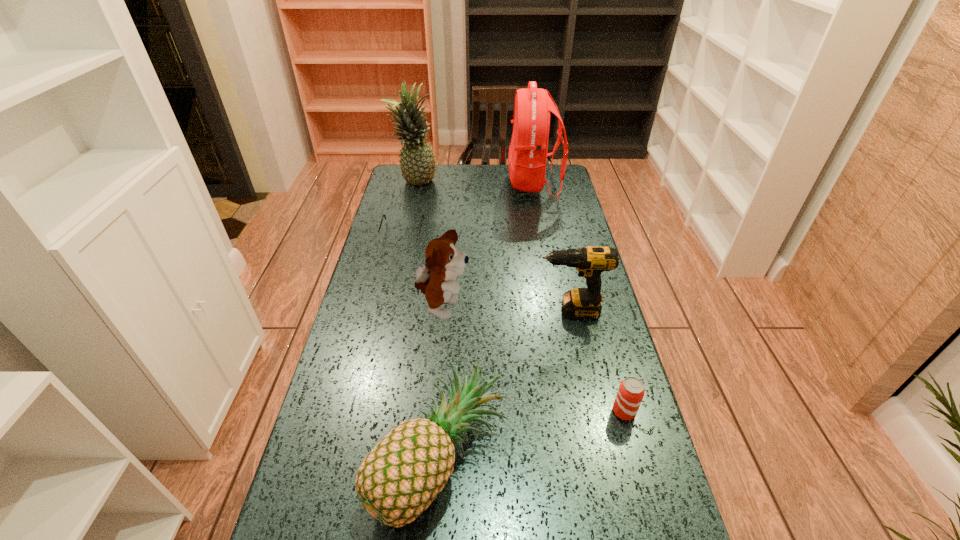
You are a GUI agent. You are given a task and a screenshot of the screen. Output one action in this format:
    pyautogui.click(x=<x>, y=<y>)
    Task: Click on the spectacles present at the left edge
    Image resolution: width=960 pixels, height=540 pixels.
    Given the screenshot: What is the action you would take?
    pyautogui.click(x=388, y=237)

This screenshot has height=540, width=960. I want to click on backpack present at the right edge, so click(527, 158).

You are a GUI agent. You are given a task and a screenshot of the screen. Output one action in this format:
    pyautogui.click(x=<x>, y=<y>)
    Task: Click on the drill at the right edge
    This screenshot has width=960, height=540.
    Given the screenshot: What is the action you would take?
    pyautogui.click(x=582, y=303)

You are a GUI agent. You are given a task and a screenshot of the screen. Output one action in this format:
    pyautogui.click(x=<x>, y=<y>)
    Task: Click on the beer can located in the right edge section of the desktop
    
    Given the screenshot: What is the action you would take?
    pyautogui.click(x=631, y=391)

Identify the location of object present at the far left corner. (417, 161).

Identify the location of object present at the far right corner. The height and width of the screenshot is (540, 960). (527, 158).

At what (x,y) coordinates should I click in order to perform the action: click on vacant space at the left edge of the desktop. Please return your answer as a coordinate pair (x, y). Image resolution: width=960 pixels, height=540 pixels. Looking at the image, I should click on (394, 380).

Identify the location of free region at the right edge of the desktop. The image size is (960, 540). (558, 298).

In the image, there is a desktop. Identify the location of free space at the far left corner. The image size is (960, 540). (401, 184).

Where is `free location at the far right corner of the desktop`? free location at the far right corner of the desktop is located at coordinates (554, 177).